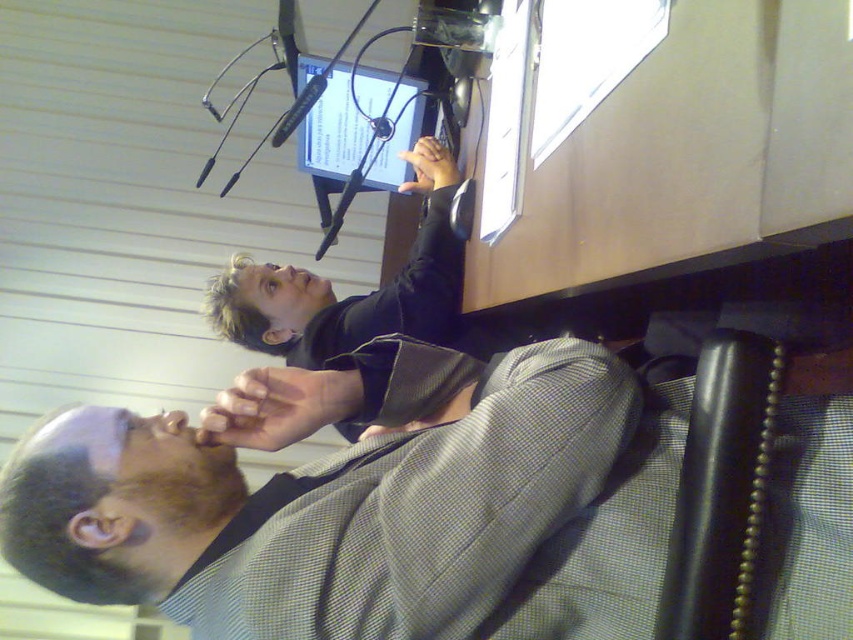
You are designing a layout for a virtual meeting background that needs to include both the matte black jacket at upper center and the matte black monitor at center. The requirement is that these two elements must be at least 12 inches apart to avoid visual clutter. Based on the current arrangement, will this setup meet the requirement?

The matte black jacket at upper center and the matte black monitor at center are currently 10.38 inches apart, which is less than the required 12 inches. Therefore, the setup does not meet the requirement and needs adjustment to increase the distance between them.

You are trying to determine the spatial relationship between the matte black jacket at upper center and the matte black monitor at center. Based on the scene description, which object is closer to the viewer?

The matte black jacket at upper center is closer to the viewer as it is positioned in front of the matte black monitor at center.